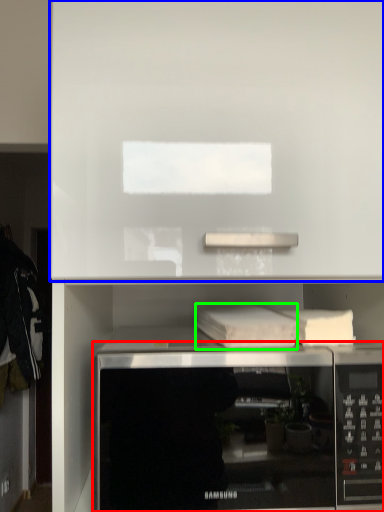
Question: Estimate the real-world distances between objects in this image. Which object is closer to microwave oven (highlighted by a red box), cabinet (highlighted by a blue box) or book (highlighted by a green box)?

Choices:
 (A) cabinet
 (B) book

Answer: (B)